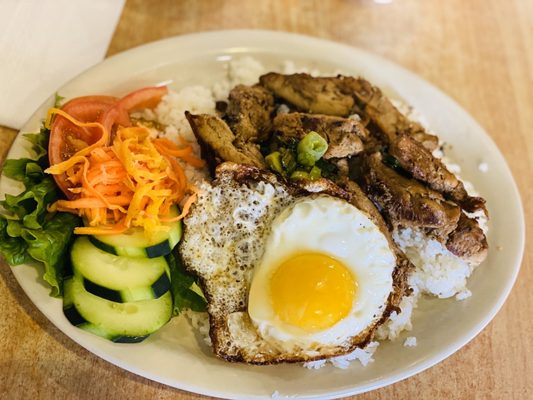
Image resolution: width=533 pixels, height=400 pixels. Find the location of `white plate`. white plate is located at coordinates (140, 65).